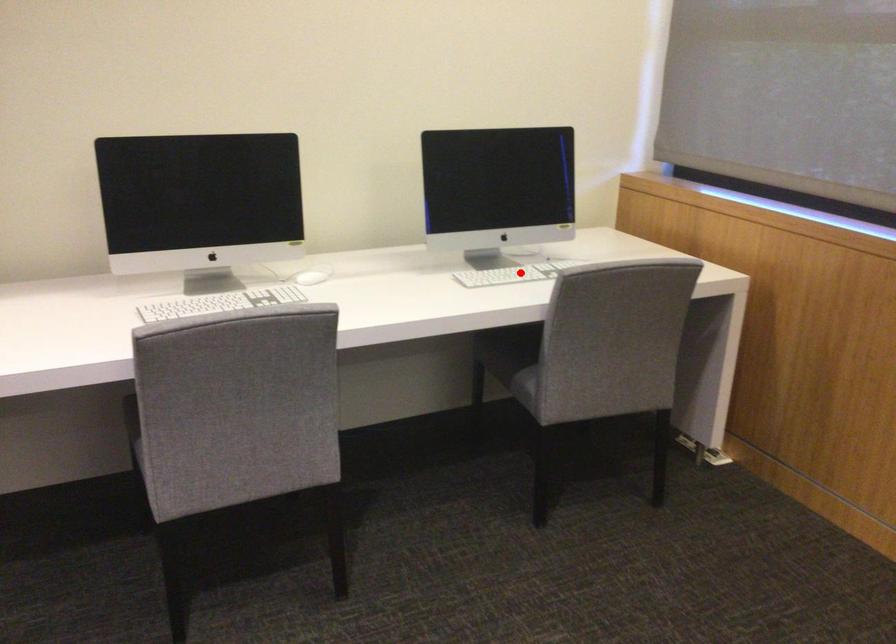
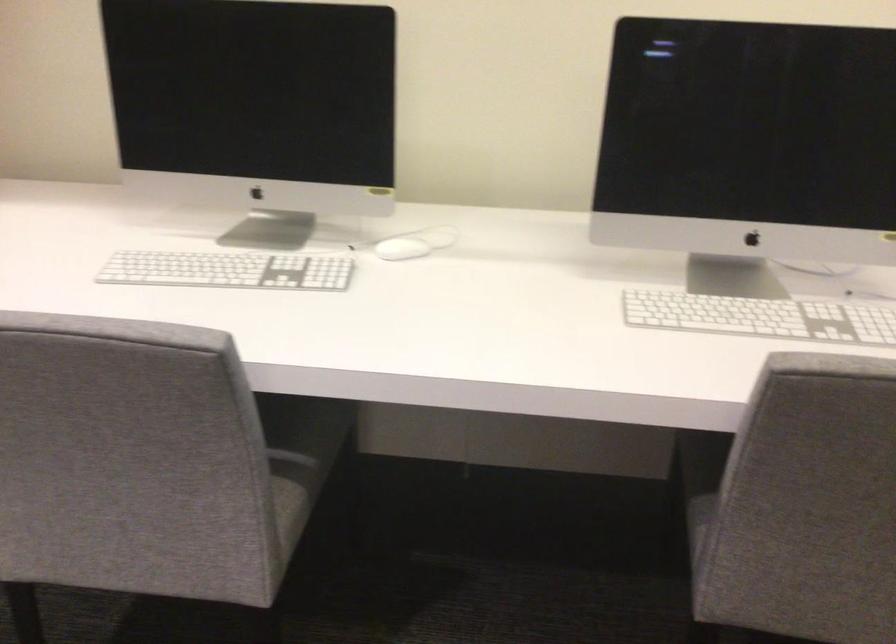
The point at the highlighted location is marked in the first image. Where is the corresponding point in the second image?

(760, 317)